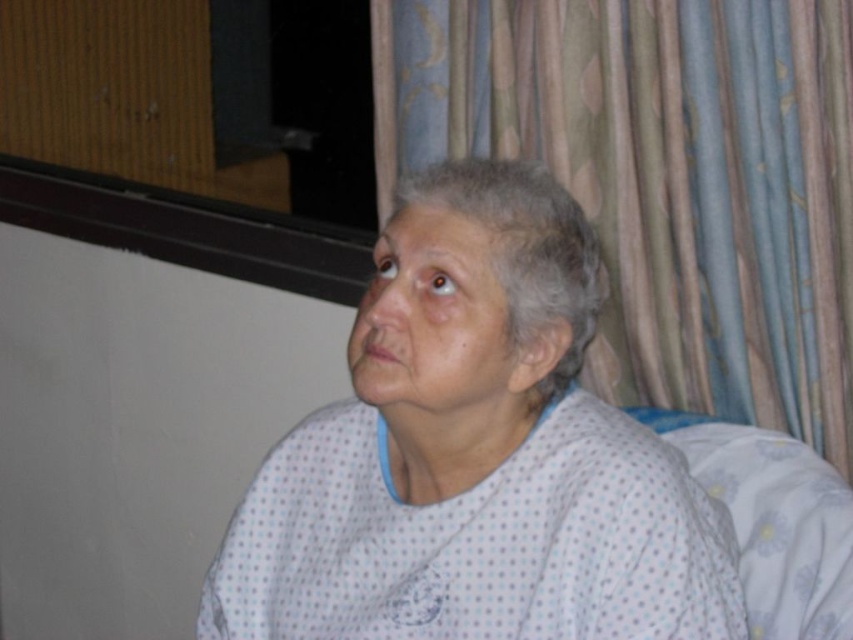
Does point (461, 424) come in front of point (701, 307)?

Yes, point (461, 424) is in front of point (701, 307).

Is white dotted fabric at center shorter than blue textured curtain at upper right?

Correct, white dotted fabric at center is not as tall as blue textured curtain at upper right.

The width and height of the screenshot is (853, 640). In order to click on white dotted fabric at center in this screenshot , I will do `click(474, 456)`.

Locate an element on the screen. white dotted fabric at center is located at coordinates (474, 456).